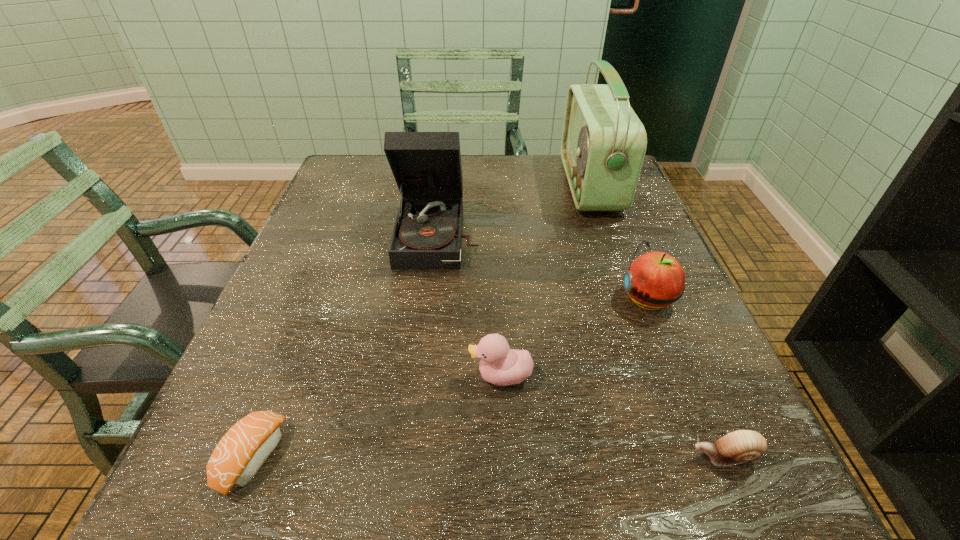
At what (x,y) coordinates should I click in order to perform the action: click on object located in the near right corner section of the desktop. Please return your answer as a coordinate pair (x, y). Looking at the image, I should click on (739, 446).

Identify the location of vacant region at the far edge. (488, 176).

The width and height of the screenshot is (960, 540). Identify the location of vacant point at the near edge. (472, 505).

Find the location of a particular element. Image resolution: width=960 pixels, height=540 pixels. vacant region at the left edge of the desktop is located at coordinates (330, 218).

Identify the location of free space at the right edge of the desktop. This screenshot has height=540, width=960. (692, 431).

Where is `free region at the far left corner`? The height and width of the screenshot is (540, 960). free region at the far left corner is located at coordinates (344, 194).

Locate an element on the screen. The width and height of the screenshot is (960, 540). vacant space at the near right corner of the desktop is located at coordinates (740, 483).

Where is `blank region between the leftmost object and the fourth tallest object`? blank region between the leftmost object and the fourth tallest object is located at coordinates 376,416.

Image resolution: width=960 pixels, height=540 pixels. What are the coordinates of `free space between the sushi and the radio receiver` in the screenshot? It's located at (420, 321).

This screenshot has height=540, width=960. Find the location of `vacant space that is in between the duckling and the sushi`. vacant space that is in between the duckling and the sushi is located at coordinates pyautogui.click(x=376, y=416).